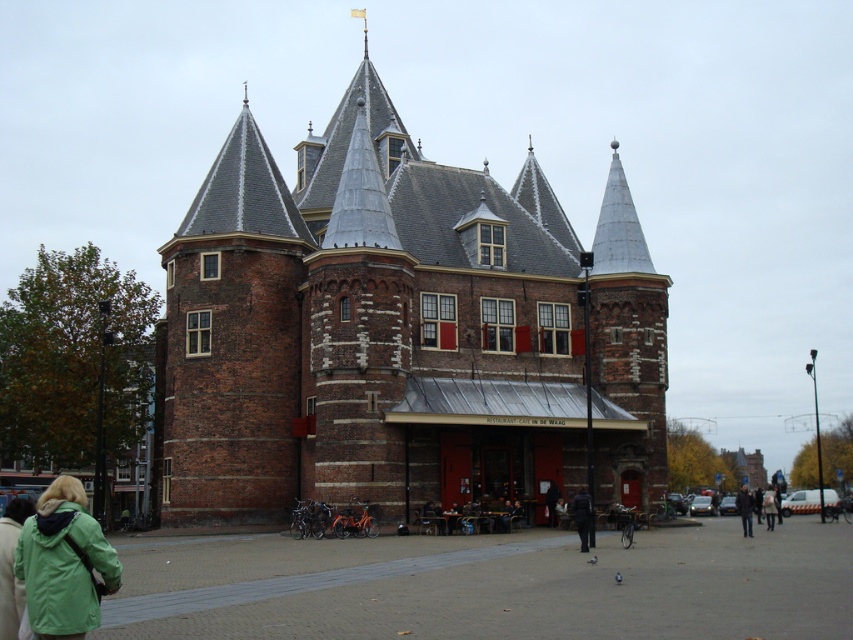
From the picture: Can you confirm if green matte jacket at lower left is taller than dark brown leather jacket at lower right?

Incorrect, green matte jacket at lower left's height is not larger of dark brown leather jacket at lower right's.

This screenshot has height=640, width=853. What do you see at coordinates (64, 563) in the screenshot? I see `green matte jacket at lower left` at bounding box center [64, 563].

Locate an element on the screen. The height and width of the screenshot is (640, 853). green matte jacket at lower left is located at coordinates (64, 563).

Who is higher up, dark brown leather jacket at center or light brown leather jacket at center?

Positioned higher is dark brown leather jacket at center.

How distant is dark brown leather jacket at center from light brown leather jacket at center?

dark brown leather jacket at center is 23.48 meters from light brown leather jacket at center.

Image resolution: width=853 pixels, height=640 pixels. Describe the element at coordinates (582, 516) in the screenshot. I see `dark brown leather jacket at center` at that location.

Where is `dark brown leather jacket at center`? The image size is (853, 640). dark brown leather jacket at center is located at coordinates [x=582, y=516].

Which is more to the left, brick building at center or dark brown leather jacket at center?

brick building at center

Between brick building at center and dark brown leather jacket at center, which one is positioned lower?

Positioned lower is dark brown leather jacket at center.

You are a GUI agent. You are given a task and a screenshot of the screen. Output one action in this format:
    pyautogui.click(x=<x>, y=<y>)
    Task: Click on the brick building at center
    
    Given the screenshot: What is the action you would take?
    pyautogui.click(x=401, y=332)